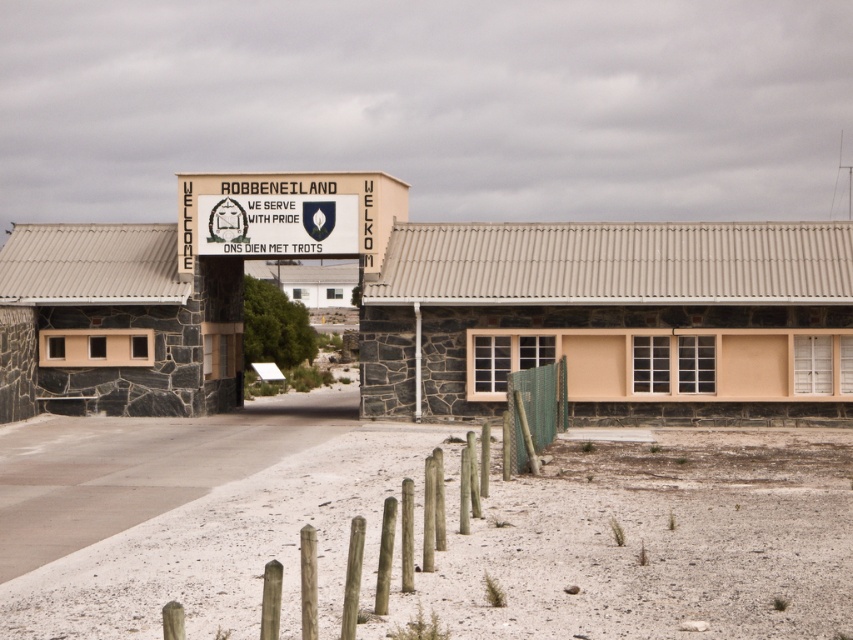
Question: Which point is farther to the camera?

Choices:
 (A) green mesh fence at lower center
 (B) white plastic sign at center

Answer: (B)

Question: Is white plastic sign at center thinner than green mesh fence at lower center?

Choices:
 (A) yes
 (B) no

Answer: (B)

Question: Does white plastic sign at center appear on the left side of green mesh fence at lower center?

Choices:
 (A) yes
 (B) no

Answer: (A)

Question: Does white plastic sign at center come in front of green mesh fence at lower center?

Choices:
 (A) no
 (B) yes

Answer: (A)